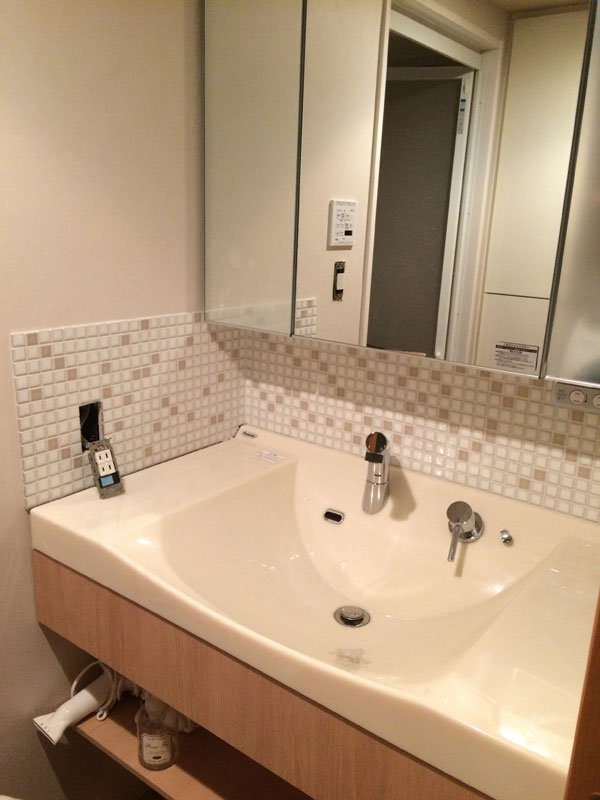
I want to click on door, so point(438,184).